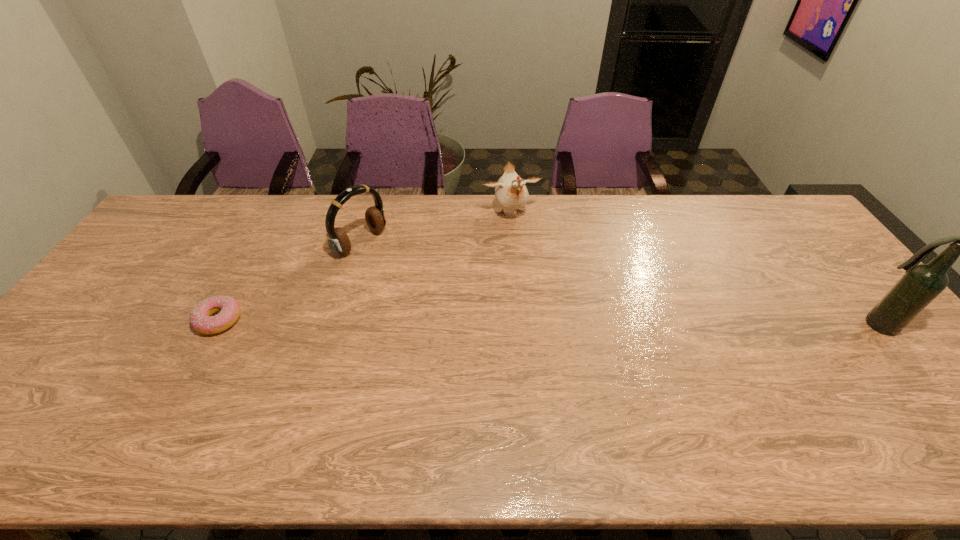
This screenshot has height=540, width=960. In order to click on free space located on the ear cup of the headset in this screenshot , I will do `click(398, 267)`.

I want to click on free space located 0.080m at the beak of the bird, so click(x=524, y=243).

You are a GUI agent. You are given a task and a screenshot of the screen. Output one action in this format:
    pyautogui.click(x=<x>, y=<y>)
    Task: Click on the free location located 0.220m at the beak of the bird
    Image resolution: width=960 pixels, height=540 pixels.
    Given the screenshot: What is the action you would take?
    pyautogui.click(x=536, y=273)

The height and width of the screenshot is (540, 960). I want to click on free point located 0.400m at the beak of the bird, so click(x=554, y=319).

The height and width of the screenshot is (540, 960). Find the location of `headset present at the far edge`. headset present at the far edge is located at coordinates (338, 241).

Locate an element on the screen. bird that is at the far edge is located at coordinates (511, 193).

Image resolution: width=960 pixels, height=540 pixels. I want to click on object located at the right edge, so click(921, 284).

You are a GUI agent. You are given a task and a screenshot of the screen. Output one action in this format:
    pyautogui.click(x=<x>, y=<y>)
    Task: Click on the free spot at the far edge of the desktop
    
    Given the screenshot: What is the action you would take?
    pyautogui.click(x=489, y=196)

This screenshot has height=540, width=960. I want to click on vacant space at the near edge of the desktop, so click(466, 393).

Identify the location of vacant space at the left edge of the desktop. This screenshot has width=960, height=540. (122, 278).